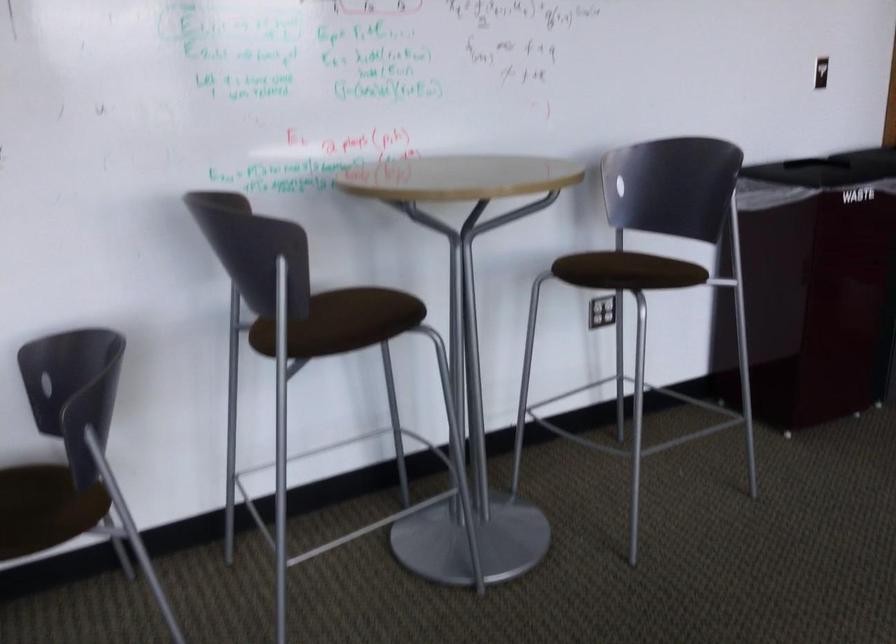
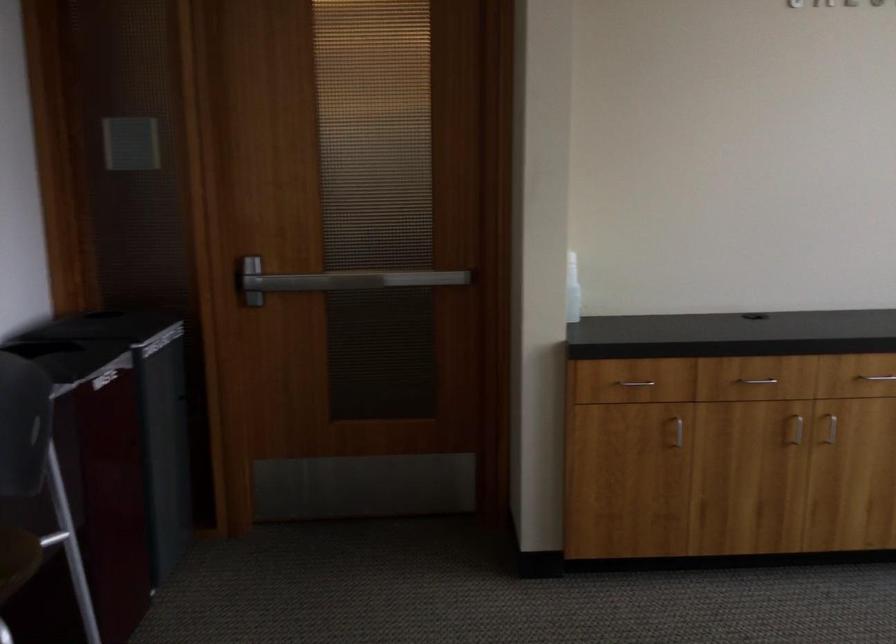
Question: The first image is from the beginning of the video and the second image is from the end. How did the camera likely rotate when shooting the video?

Choices:
 (A) Left
 (B) Right
 (C) Up
 (D) Down

Answer: (B)